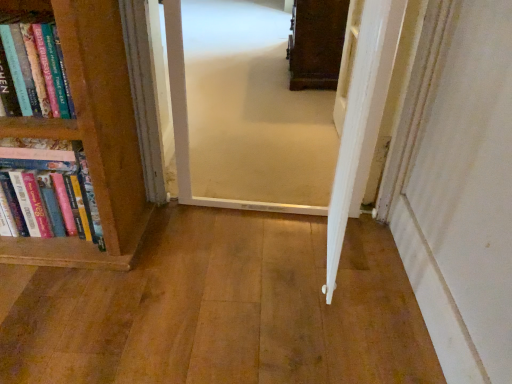
The image size is (512, 384). I want to click on carpeted corridor at center, which appears as the second corridor when ordered from the bottom, so click(x=244, y=112).

The width and height of the screenshot is (512, 384). In order to click on wooden floor at center, which ranks as the first corridor in bottom-to-top order in this screenshot , I will do tap(220, 309).

This screenshot has height=384, width=512. What do you see at coordinates (51, 188) in the screenshot? I see `hardcover books at left` at bounding box center [51, 188].

The image size is (512, 384). I want to click on carpeted corridor at center, which appears as the second corridor when ordered from the bottom, so click(x=244, y=112).

Between hardcover books at left and carpeted corridor at center, the first corridor from the top, which one has smaller size?

With smaller size is carpeted corridor at center, the first corridor from the top.

This screenshot has width=512, height=384. Find the location of `book below the carpeted corridor at center, which appears as the second corridor when ordered from the bottom (from the image's perspective)`. book below the carpeted corridor at center, which appears as the second corridor when ordered from the bottom (from the image's perspective) is located at coordinates (51, 188).

Is hardcover books at left in front of or behind carpeted corridor at center, which appears as the second corridor when ordered from the bottom, in the image?

Clearly, hardcover books at left is in front of carpeted corridor at center, which appears as the second corridor when ordered from the bottom.

Find the location of a particular element. The height and width of the screenshot is (384, 512). the 1st corridor counting from the right of the hardcover books at left is located at coordinates (220, 309).

From the picture: Between wooden floor at center, which ranks as the first corridor in bottom-to-top order, and hardcover books at left, which one appears on the right side from the viewer's perspective?

wooden floor at center, which ranks as the first corridor in bottom-to-top order, is more to the right.

From a real-world perspective, is wooden floor at center, arranged as the second corridor when viewed from the top, physically located above or below hardcover books at left?

In terms of real-world spatial position, wooden floor at center, arranged as the second corridor when viewed from the top, is below hardcover books at left.

Does wooden floor at center, arranged as the second corridor when viewed from the top, have a lesser width compared to hardcover books at left?

In fact, wooden floor at center, arranged as the second corridor when viewed from the top, might be wider than hardcover books at left.

Between carpeted corridor at center, the first corridor from the top, and wooden floor at center, arranged as the second corridor when viewed from the top, which one has less height?

wooden floor at center, arranged as the second corridor when viewed from the top.

Could you tell me if carpeted corridor at center, the first corridor from the top, is turned towards wooden floor at center, arranged as the second corridor when viewed from the top?

No, carpeted corridor at center, the first corridor from the top, does not turn towards wooden floor at center, arranged as the second corridor when viewed from the top.

Between carpeted corridor at center, which appears as the second corridor when ordered from the bottom, and wooden floor at center, which ranks as the first corridor in bottom-to-top order, which one appears on the left side from the viewer's perspective?

Positioned to the left is wooden floor at center, which ranks as the first corridor in bottom-to-top order.

Is carpeted corridor at center, the first corridor from the top, bigger or smaller than wooden floor at center, which ranks as the first corridor in bottom-to-top order?

A: Clearly, carpeted corridor at center, the first corridor from the top, is smaller in size than wooden floor at center, which ranks as the first corridor in bottom-to-top order.

Considering the relative positions of carpeted corridor at center, which appears as the second corridor when ordered from the bottom, and hardcover books at left in the image provided, is carpeted corridor at center, which appears as the second corridor when ordered from the bottom, to the right of hardcover books at left from the viewer's perspective?

Correct, you'll find carpeted corridor at center, which appears as the second corridor when ordered from the bottom, to the right of hardcover books at left.

Is carpeted corridor at center, which appears as the second corridor when ordered from the bottom, behind hardcover books at left?

Yes, carpeted corridor at center, which appears as the second corridor when ordered from the bottom, is behind hardcover books at left.

Is carpeted corridor at center, which appears as the second corridor when ordered from the bottom, with hardcover books at left?

No, carpeted corridor at center, which appears as the second corridor when ordered from the bottom, is not touching hardcover books at left.

I want to click on book above the wooden floor at center, which ranks as the first corridor in bottom-to-top order (from the image's perspective), so click(51, 188).

In the scene shown: Could you tell me if hardcover books at left is facing wooden floor at center, which ranks as the first corridor in bottom-to-top order?

No, hardcover books at left is not aimed at wooden floor at center, which ranks as the first corridor in bottom-to-top order.

Does hardcover books at left have a greater height compared to wooden floor at center, which ranks as the first corridor in bottom-to-top order?

Yes, hardcover books at left is taller than wooden floor at center, which ranks as the first corridor in bottom-to-top order.

How distant is hardcover books at left from wooden floor at center, which ranks as the first corridor in bottom-to-top order?

A distance of 15.07 inches exists between hardcover books at left and wooden floor at center, which ranks as the first corridor in bottom-to-top order.

Can you confirm if wooden floor at center, arranged as the second corridor when viewed from the top, is taller than carpeted corridor at center, the first corridor from the top?

Incorrect, the height of wooden floor at center, arranged as the second corridor when viewed from the top, is not larger of that of carpeted corridor at center, the first corridor from the top.

Consider the image. Is wooden floor at center, arranged as the second corridor when viewed from the top, facing towards carpeted corridor at center, the first corridor from the top?

Yes, wooden floor at center, arranged as the second corridor when viewed from the top, is aimed at carpeted corridor at center, the first corridor from the top.

Between wooden floor at center, arranged as the second corridor when viewed from the top, and carpeted corridor at center, the first corridor from the top, which one is positioned in front?

wooden floor at center, arranged as the second corridor when viewed from the top, is more forward.

In order to click on corridor above the hardcover books at left (from a real-world perspective) in this screenshot , I will do click(244, 112).

This screenshot has height=384, width=512. Find the location of `book that is above the wooden floor at center, which ranks as the first corridor in bottom-to-top order (from the image's perspective)`. book that is above the wooden floor at center, which ranks as the first corridor in bottom-to-top order (from the image's perspective) is located at coordinates (51, 188).

In the scene shown: Considering their positions, is hardcover books at left positioned closer to wooden floor at center, arranged as the second corridor when viewed from the top, than carpeted corridor at center, the first corridor from the top?

Based on the image, hardcover books at left appears to be nearer to wooden floor at center, arranged as the second corridor when viewed from the top.

From the image, which object appears to be farther from carpeted corridor at center, which appears as the second corridor when ordered from the bottom, hardcover books at left or wooden floor at center, which ranks as the first corridor in bottom-to-top order?

The object further to carpeted corridor at center, which appears as the second corridor when ordered from the bottom, is hardcover books at left.

Looking at the image, which one is located further to wooden floor at center, arranged as the second corridor when viewed from the top, carpeted corridor at center, which appears as the second corridor when ordered from the bottom, or hardcover books at left?

carpeted corridor at center, which appears as the second corridor when ordered from the bottom, lies further to wooden floor at center, arranged as the second corridor when viewed from the top, than the other object.

Which object lies nearer to the anchor point carpeted corridor at center, which appears as the second corridor when ordered from the bottom, wooden floor at center, arranged as the second corridor when viewed from the top, or hardcover books at left?

wooden floor at center, arranged as the second corridor when viewed from the top.

Looking at the image, which one is located further to hardcover books at left, wooden floor at center, which ranks as the first corridor in bottom-to-top order, or carpeted corridor at center, which appears as the second corridor when ordered from the bottom?

carpeted corridor at center, which appears as the second corridor when ordered from the bottom, is further to hardcover books at left.

Based on their spatial positions, is carpeted corridor at center, the first corridor from the top, or wooden floor at center, arranged as the second corridor when viewed from the top, closer to hardcover books at left?

wooden floor at center, arranged as the second corridor when viewed from the top, lies closer to hardcover books at left than the other object.

Where is `corridor between hardcover books at left and carpeted corridor at center, which appears as the second corridor when ordered from the bottom, in the horizontal direction`? corridor between hardcover books at left and carpeted corridor at center, which appears as the second corridor when ordered from the bottom, in the horizontal direction is located at coordinates (220, 309).